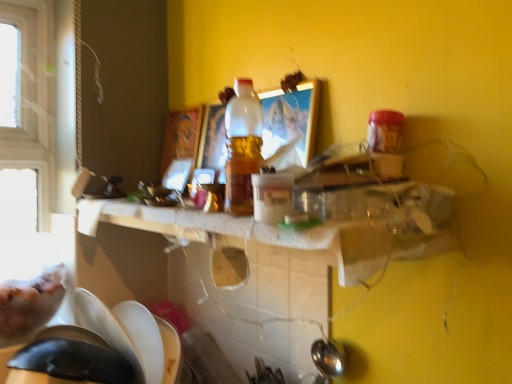
Question: Is translucent plastic bottle at center smaller than white paper towel at center?

Choices:
 (A) yes
 (B) no

Answer: (A)

Question: From the image's perspective, is translucent plastic bottle at center over white paper towel at center?

Choices:
 (A) yes
 (B) no

Answer: (A)

Question: Is translucent plastic bottle at center not within white paper towel at center?

Choices:
 (A) yes
 (B) no

Answer: (A)

Question: Can you confirm if translucent plastic bottle at center is bigger than white paper towel at center?

Choices:
 (A) no
 (B) yes

Answer: (A)

Question: Can you confirm if translucent plastic bottle at center is shorter than white paper towel at center?

Choices:
 (A) no
 (B) yes

Answer: (A)

Question: Can white paper towel at center be found inside translucent plastic bottle at center?

Choices:
 (A) no
 (B) yes

Answer: (A)

Question: From the image's perspective, is white paper towel at center beneath translucent plastic bottle at center?

Choices:
 (A) no
 (B) yes

Answer: (B)

Question: Is white paper towel at center with translucent plastic bottle at center?

Choices:
 (A) no
 (B) yes

Answer: (A)

Question: From a real-world perspective, is white paper towel at center physically below translucent plastic bottle at center?

Choices:
 (A) no
 (B) yes

Answer: (B)

Question: Considering the relative sizes of white paper towel at center and translucent plastic bottle at center in the image provided, is white paper towel at center bigger than translucent plastic bottle at center?

Choices:
 (A) yes
 (B) no

Answer: (A)

Question: Is white paper towel at center at the left side of translucent plastic bottle at center?

Choices:
 (A) no
 (B) yes

Answer: (B)

Question: Is white paper towel at center in front of translucent plastic bottle at center?

Choices:
 (A) yes
 (B) no

Answer: (A)

Question: Looking at their shapes, would you say white paper towel at center is wider or thinner than translucent plastic bottle at center?

Choices:
 (A) thin
 (B) wide

Answer: (B)